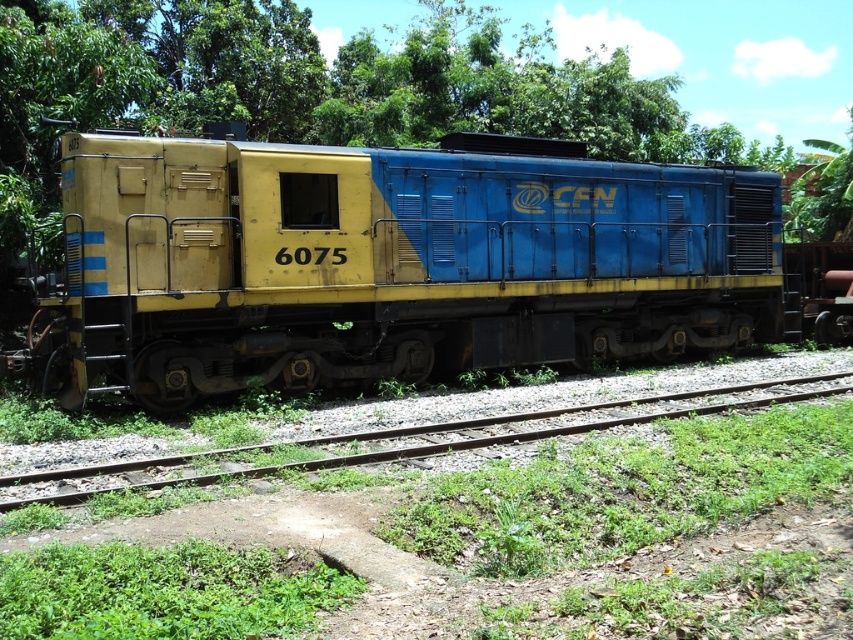
Is yellow matte train at center positioned at the back of gravel track at center?

Yes, it is behind gravel track at center.

Which of these two, yellow matte train at center or gravel track at center, stands taller?

yellow matte train at center

Is point (421, 259) farther from viewer compared to point (743, 390)?

No, it is not.

Locate an element on the screen. yellow matte train at center is located at coordinates (387, 262).